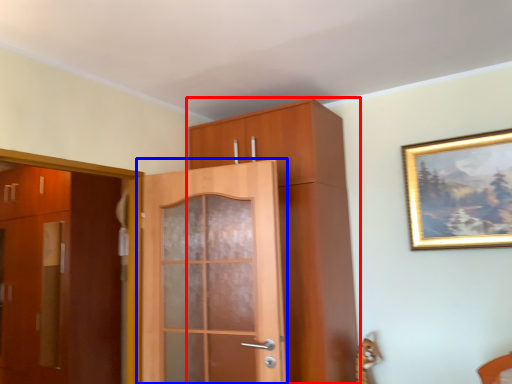
Question: Among these objects, which one is farthest to the camera, cabinetry (highlighted by a red box) or door (highlighted by a blue box)?

Choices:
 (A) cabinetry
 (B) door

Answer: (A)